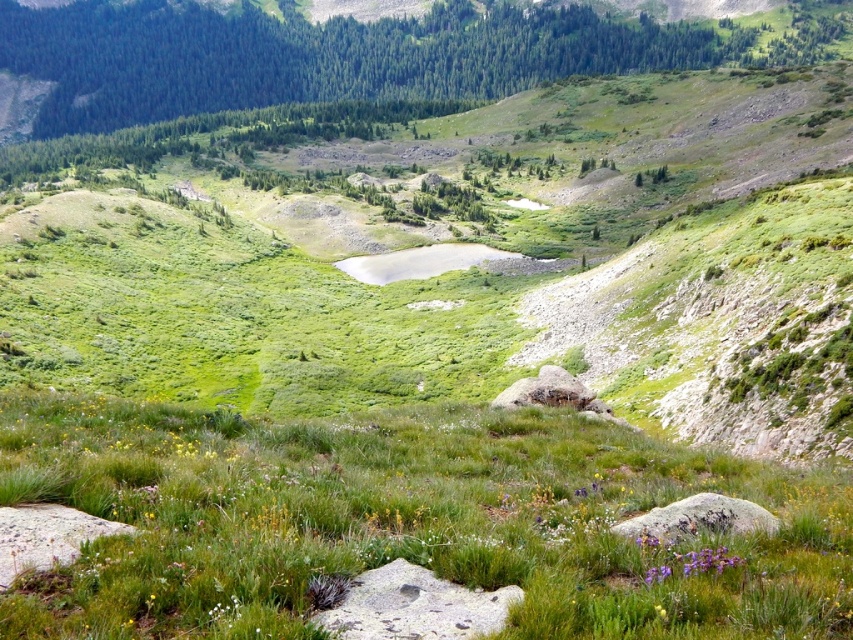
Image resolution: width=853 pixels, height=640 pixels. What are the coordinates of `green grassy at center` in the screenshot? It's located at (402, 522).

Looking at this image, does green grassy at center have a lesser height compared to gray rough rock at lower left?

No, green grassy at center is not shorter than gray rough rock at lower left.

This screenshot has height=640, width=853. I want to click on green grassy at center, so pos(402,522).

Find the location of `green grassy at center`. green grassy at center is located at coordinates (402, 522).

Describe the element at coordinates (45, 536) in the screenshot. I see `gray rough rock at lower left` at that location.

How distant is gray rough rock at lower left from purple matte flower at lower right?

The distance of gray rough rock at lower left from purple matte flower at lower right is 21.44 feet.

Is point (67, 547) closer to camera compared to point (705, 557)?

Yes.

Where is `gray rough rock at lower left`? This screenshot has width=853, height=640. gray rough rock at lower left is located at coordinates (45, 536).

From the picture: Is gray rough rock at lower left wider than gray rough rock at lower right?

Incorrect, gray rough rock at lower left's width does not surpass gray rough rock at lower right's.

Can you confirm if gray rough rock at lower left is positioned to the right of gray rough rock at lower right?

Incorrect, gray rough rock at lower left is not on the right side of gray rough rock at lower right.

Is point (44, 531) less distant than point (665, 508)?

Yes, it is in front of point (665, 508).

Locate an element on the screen. Image resolution: width=853 pixels, height=640 pixels. gray rough rock at lower left is located at coordinates (45, 536).